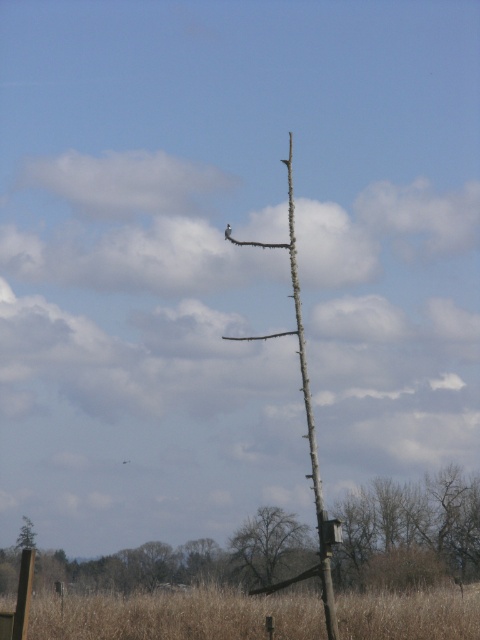
Question: Is bare wood pole at lower center thinner than dark brown bark tree at center?

Choices:
 (A) no
 (B) yes

Answer: (A)

Question: Which object is closer to the camera taking this photo?

Choices:
 (A) dark brown bark tree at center
 (B) bare wood pole at lower center

Answer: (B)

Question: Which object is farther from the camera taking this photo?

Choices:
 (A) brown rough wood telegraph pole at center
 (B) dark brown bark tree at center

Answer: (B)

Question: Which object appears farthest from the camera in this image?

Choices:
 (A) bare wood pole at lower center
 (B) brown rough wood telegraph pole at center
 (C) dark brown bark tree at center

Answer: (C)

Question: Does bare wood pole at lower center appear over brown rough wood telegraph pole at center?

Choices:
 (A) yes
 (B) no

Answer: (B)

Question: Considering the relative positions of brown rough wood telegraph pole at center and dark brown bark tree at center in the image provided, where is brown rough wood telegraph pole at center located with respect to dark brown bark tree at center?

Choices:
 (A) right
 (B) left

Answer: (B)